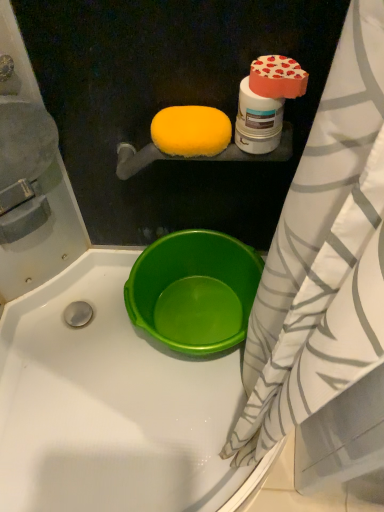
Question: Is yellow sponge at upper center, positioned as the 1th food in back-to-front order, to the right of smooth matte heart-shaped box at upper right, marked as the 1th food in a front-to-back arrangement, from the viewer's perspective?

Choices:
 (A) no
 (B) yes

Answer: (A)

Question: Is the position of yellow sponge at upper center, the second food positioned from the front, less distant than that of smooth matte heart-shaped box at upper right, marked as the 1th food in a front-to-back arrangement?

Choices:
 (A) yes
 (B) no

Answer: (B)

Question: Does yellow sponge at upper center, arranged as the first food when viewed from the left, have a greater width compared to smooth matte heart-shaped box at upper right, which ranks as the 2th food in back-to-front order?

Choices:
 (A) no
 (B) yes

Answer: (B)

Question: From the image's perspective, is yellow sponge at upper center, the second food positioned from the front, on top of smooth matte heart-shaped box at upper right, the 2th food from the left?

Choices:
 (A) yes
 (B) no

Answer: (B)

Question: Considering the relative positions of yellow sponge at upper center, arranged as the 2th food when viewed from the right, and smooth matte heart-shaped box at upper right, marked as the 1th food in a front-to-back arrangement, in the image provided, is yellow sponge at upper center, arranged as the 2th food when viewed from the right, to the left of smooth matte heart-shaped box at upper right, marked as the 1th food in a front-to-back arrangement, from the viewer's perspective?

Choices:
 (A) no
 (B) yes

Answer: (B)

Question: From a real-world perspective, is yellow sponge at upper center, arranged as the 2th food when viewed from the right, located higher than smooth matte heart-shaped box at upper right, marked as the 1th food in a front-to-back arrangement?

Choices:
 (A) no
 (B) yes

Answer: (A)

Question: Is white striped fabric at right in contact with smooth matte heart-shaped box at upper right, which ranks as the 2th food in back-to-front order?

Choices:
 (A) no
 (B) yes

Answer: (A)

Question: Is there a large distance between white striped fabric at right and smooth matte heart-shaped box at upper right, marked as the 1th food in a front-to-back arrangement?

Choices:
 (A) no
 (B) yes

Answer: (A)

Question: From the image's perspective, is white striped fabric at right on top of smooth matte heart-shaped box at upper right, which ranks as the 2th food in back-to-front order?

Choices:
 (A) no
 (B) yes

Answer: (A)

Question: From a real-world perspective, is white striped fabric at right located higher than smooth matte heart-shaped box at upper right, marked as the 1th food in a front-to-back arrangement?

Choices:
 (A) no
 (B) yes

Answer: (A)

Question: Considering the relative sizes of white striped fabric at right and smooth matte heart-shaped box at upper right, which ranks as the 2th food in back-to-front order, in the image provided, is white striped fabric at right taller than smooth matte heart-shaped box at upper right, which ranks as the 2th food in back-to-front order,?

Choices:
 (A) yes
 (B) no

Answer: (A)

Question: Is white striped fabric at right bigger than smooth matte heart-shaped box at upper right, which is counted as the 1th food, starting from the right?

Choices:
 (A) yes
 (B) no

Answer: (A)

Question: Is yellow sponge at upper center, arranged as the 2th food when viewed from the right, positioned beyond the bounds of white striped fabric at right?

Choices:
 (A) yes
 (B) no

Answer: (A)